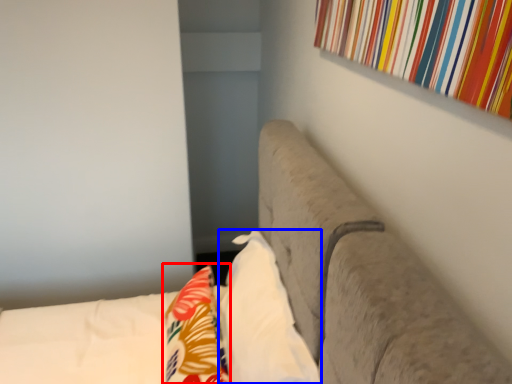
Question: Which point is further to the camera, throw pillow (highlighted by a red box) or pillow (highlighted by a blue box)?

Choices:
 (A) throw pillow
 (B) pillow

Answer: (A)